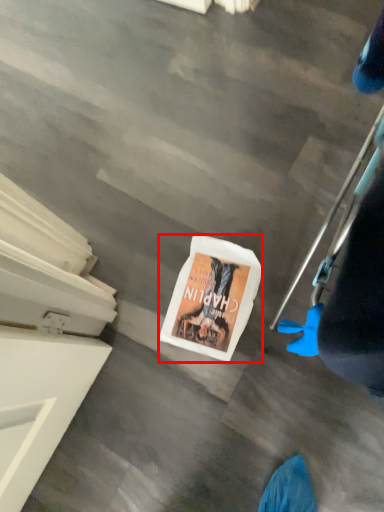
Question: From the image, what is the correct spatial relationship of magazine (annotated by the red box) in relation to person?

Choices:
 (A) left
 (B) right

Answer: (A)